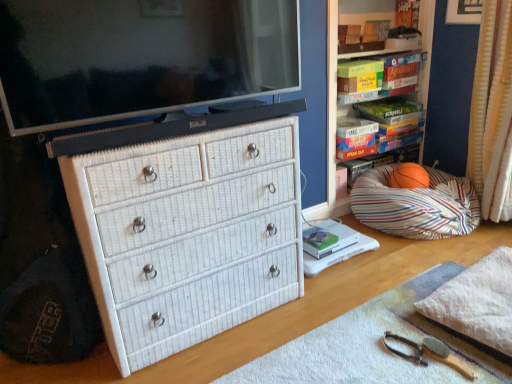
Question: Can you confirm if white fluffy blanket at lower right is wider than hardcover book at upper right, the 1th book when ordered from right to left?

Choices:
 (A) yes
 (B) no

Answer: (A)

Question: Would you say white fluffy blanket at lower right is a long distance from hardcover book at upper right, which is the 2th book from front to back?

Choices:
 (A) no
 (B) yes

Answer: (B)

Question: Can you confirm if white fluffy blanket at lower right is positioned to the right of hardcover book at upper right, the 1th book when ordered from right to left?

Choices:
 (A) yes
 (B) no

Answer: (A)

Question: Is white fluffy blanket at lower right looking in the opposite direction of hardcover book at upper right, the 2th book viewed from the left?

Choices:
 (A) no
 (B) yes

Answer: (A)

Question: Is white fluffy blanket at lower right shorter than hardcover book at upper right, which is the 2th book from front to back?

Choices:
 (A) no
 (B) yes

Answer: (B)

Question: Can you see white fluffy blanket at lower right touching hardcover book at upper right, which appears as the second book when ordered from the bottom?

Choices:
 (A) no
 (B) yes

Answer: (A)

Question: Is striped fabric bean bag at right placed right next to hardcover book at upper right, which is the 2th book from front to back?

Choices:
 (A) yes
 (B) no

Answer: (B)

Question: From a real-world perspective, does striped fabric bean bag at right stand above hardcover book at upper right, which appears as the second book when ordered from the bottom?

Choices:
 (A) yes
 (B) no

Answer: (B)

Question: Does striped fabric bean bag at right have a greater height compared to hardcover book at upper right, which is the 2th book from front to back?

Choices:
 (A) yes
 (B) no

Answer: (A)

Question: From the image's perspective, does striped fabric bean bag at right appear lower than hardcover book at upper right, the 1th book when ordered from right to left?

Choices:
 (A) no
 (B) yes

Answer: (B)

Question: Considering the relative positions of striped fabric bean bag at right and hardcover book at upper right, which is the 2th book from front to back, in the image provided, is striped fabric bean bag at right to the right of hardcover book at upper right, which is the 2th book from front to back, from the viewer's perspective?

Choices:
 (A) yes
 (B) no

Answer: (A)

Question: Can you confirm if striped fabric bean bag at right is shorter than hardcover book at upper right, positioned as the 1th book in top-to-bottom order?

Choices:
 (A) no
 (B) yes

Answer: (A)

Question: From the image's perspective, is hardcover book at center, which is counted as the first book, starting from the left, below hardcover book at upper right, the 2th book viewed from the left?

Choices:
 (A) no
 (B) yes

Answer: (B)